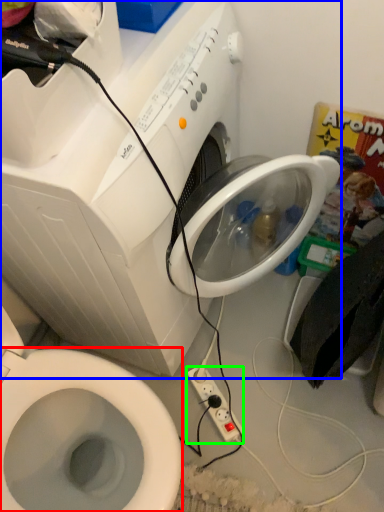
Question: Based on their relative distances, which object is nearer to bidet (highlighted by a red box)? Choose from washing machine (highlighted by a blue box) and power plugs and sockets (highlighted by a green box).

Choices:
 (A) washing machine
 (B) power plugs and sockets

Answer: (A)